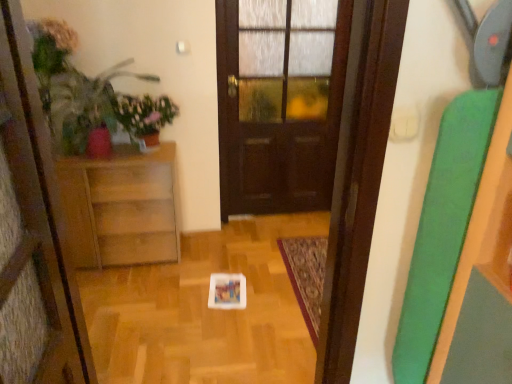
Question: From a real-world perspective, is wooden cabinet at left physically located above or below dark wood door at center?

Choices:
 (A) above
 (B) below

Answer: (B)

Question: In the image, is wooden cabinet at left on the left side or the right side of dark wood door at center?

Choices:
 (A) left
 (B) right

Answer: (A)

Question: Which of these objects is positioned farthest from the green matte plant at upper left?

Choices:
 (A) wooden cabinet at left
 (B) dark wood door at center
 (C) matte green plant at left

Answer: (B)

Question: Based on their relative distances, which object is farther from the dark wood door at center?

Choices:
 (A) matte green plant at left
 (B) green matte plant at upper left
 (C) wooden cabinet at left

Answer: (A)